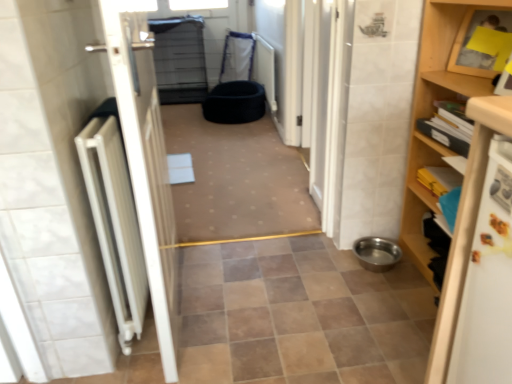
What are the coordinates of `free space in front of metallic stainless steel bowl at lower right, arranged as the 2th toilet bowl when viewed from the top` in the screenshot? It's located at (389, 294).